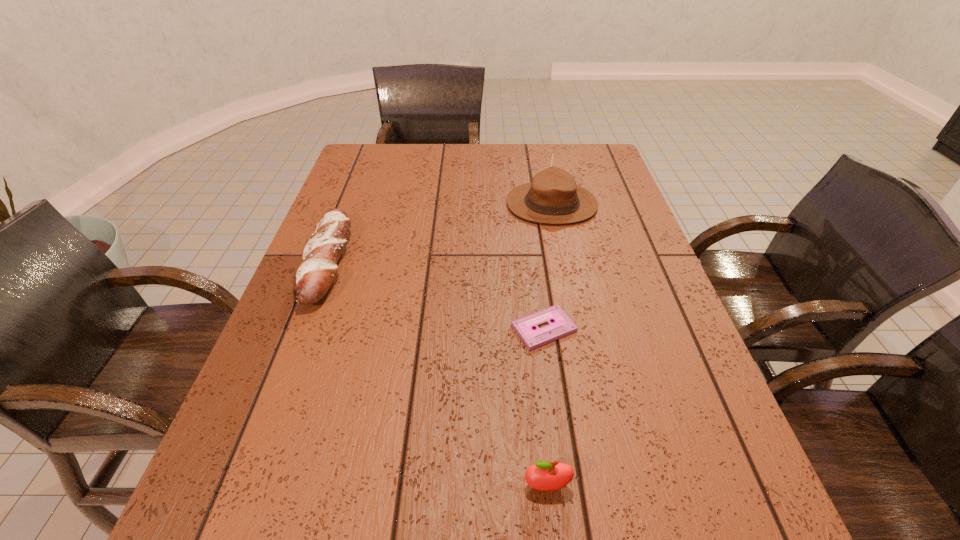
The width and height of the screenshot is (960, 540). I want to click on vacant region located on the right of the shortest object, so click(600, 328).

Where is `object present at the left edge`? Image resolution: width=960 pixels, height=540 pixels. object present at the left edge is located at coordinates (315, 274).

Where is `object that is at the right edge`? This screenshot has width=960, height=540. object that is at the right edge is located at coordinates (553, 197).

Locate an element on the screen. vacant space at the far edge of the desktop is located at coordinates (492, 172).

Identify the location of blank area at the left edge. (254, 384).

In the image, there is a desktop. What are the coordinates of `free space at the right edge` in the screenshot? It's located at (660, 281).

Locate an element on the screen. This screenshot has width=960, height=540. free spot at the far left corner of the desktop is located at coordinates (401, 147).

In the image, there is a desktop. Where is `vacant space at the far right corner`? This screenshot has height=540, width=960. vacant space at the far right corner is located at coordinates (588, 159).

Locate an element on the screen. free space between the apple and the shortest object is located at coordinates (545, 407).

I want to click on vacant area that lies between the fedora and the baguet, so click(x=440, y=233).